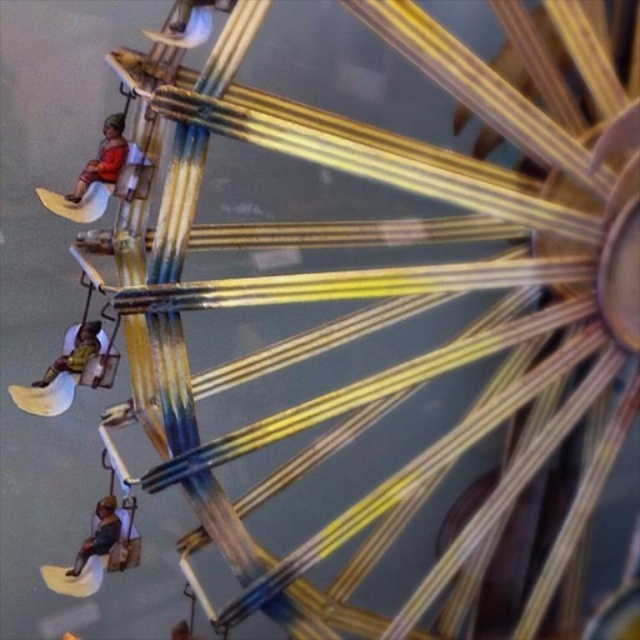
Question: Does matte orange fabric at upper left come in front of green fabric at lower left?

Choices:
 (A) yes
 (B) no

Answer: (A)

Question: Estimate the real-world distances between objects in this image. Which object is closer to the green fabric at lower left?

Choices:
 (A) dark brown wooden figure at lower left
 (B) matte orange fabric at upper left

Answer: (A)

Question: Observing the image, what is the correct spatial positioning of matte orange fabric at upper left in reference to green fabric at lower left?

Choices:
 (A) right
 (B) left

Answer: (A)

Question: Estimate the real-world distances between objects in this image. Which object is closer to the green fabric at lower left?

Choices:
 (A) matte orange fabric at upper left
 (B) dark brown wooden figure at lower left

Answer: (B)

Question: Which object is the closest to the matte orange fabric at upper left?

Choices:
 (A) dark brown wooden figure at lower left
 (B) green fabric at lower left

Answer: (B)

Question: Observing the image, what is the correct spatial positioning of dark brown wooden figure at lower left in reference to green fabric at lower left?

Choices:
 (A) above
 (B) below

Answer: (B)